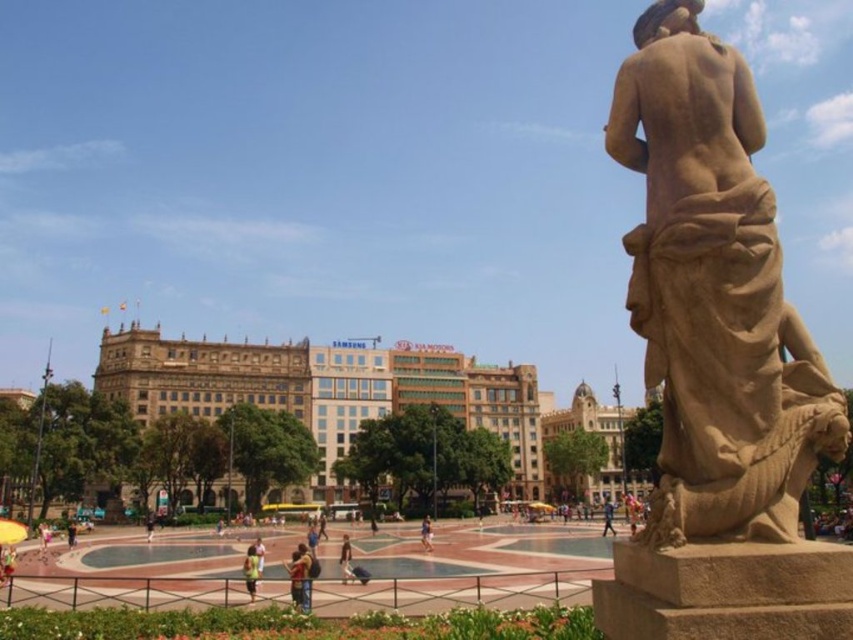
You are standing in the plaza and want to take a photo of both the statue and the buildings in the background. If you position yourself so that the statue is at point (42, 525) and the buildings are at point (151, 525) in your camera frame, will the statue appear closer to you than the buildings?

Yes, the statue at point (42, 525) will appear closer to you than the buildings at point (151, 525) because the point (42, 525) is further to the camera than point (151, 525).

You are standing in the plaza and see the statue of a nude female figure on its pedestal. You notice a light brown fabric dress at lower left marked by point (44, 534). If you want to take a photo of the statue without the dress in the frame, which direction should you move?

Move away from the light brown fabric dress at lower left marked by point (44, 534) to ensure it is not in the photo frame.